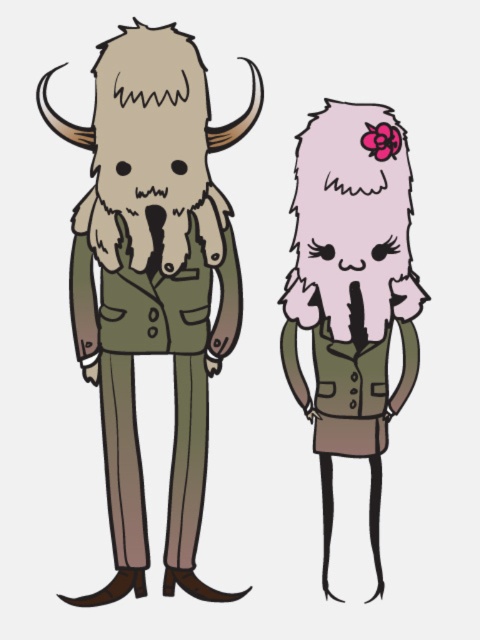
In the image, there are two characters with distinct fur colors. The first has fuzzy beige fur at left, and the second has pink fluffy fur at right. From the viewer perspective, which character is positioned more to the left?

The fuzzy beige fur at left is positioned to the left of the pink fluffy fur at right, so the character with fuzzy beige fur at left is more to the left.

You are an artist trying to draw the scene. You need to decide the order to draw the characters so that the one closer to the viewer is drawn first. Which character should you draw first, the fuzzy beige fur at left or the pink fluffy fur at right?

The fuzzy beige fur at left should be drawn first because it is in front of the pink fluffy fur at right, making it closer to the viewer.